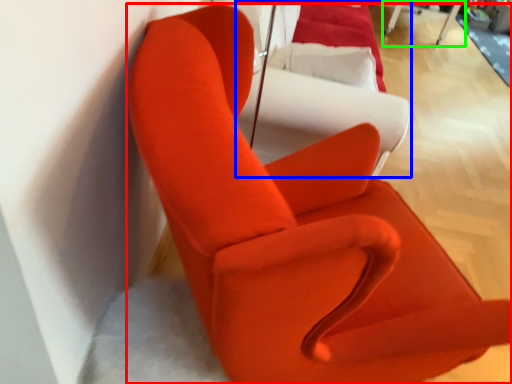
Question: Based on their relative distances, which object is nearer to chair (highlighted by a red box)? Choose from couch (highlighted by a blue box) and table (highlighted by a green box).

Choices:
 (A) couch
 (B) table

Answer: (A)